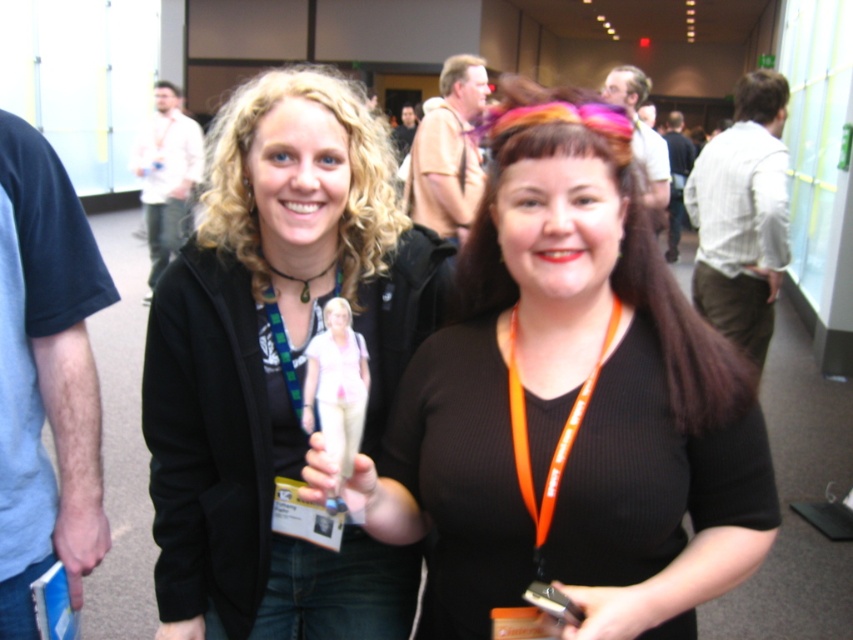
Who is positioned more to the left, black matte shirt at center or green fabric lanyard at center?

Positioned to the left is green fabric lanyard at center.

Which is behind, point (437, 620) or point (276, 324)?

The point (276, 324) is behind.

The height and width of the screenshot is (640, 853). What do you see at coordinates (572, 403) in the screenshot?
I see `black matte shirt at center` at bounding box center [572, 403].

Locate an element on the screen. The width and height of the screenshot is (853, 640). black matte shirt at center is located at coordinates (572, 403).

Which is below, black matte shirt at center or matte black jacket at center?

black matte shirt at center is below.

Is black matte shirt at center positioned behind matte black jacket at center?

No, it is not.

Between point (614, 460) and point (202, 564), which one is positioned behind?

Positioned behind is point (202, 564).

Locate an element on the screen. black matte shirt at center is located at coordinates (572, 403).

Is matte black jacket at center shorter than green fabric lanyard at center?

In fact, matte black jacket at center may be taller than green fabric lanyard at center.

Is matte black jacket at center taller than green fabric lanyard at center?

Yes.

This screenshot has width=853, height=640. What do you see at coordinates (277, 362) in the screenshot?
I see `matte black jacket at center` at bounding box center [277, 362].

Identify the location of matte black jacket at center. Image resolution: width=853 pixels, height=640 pixels. (277, 362).